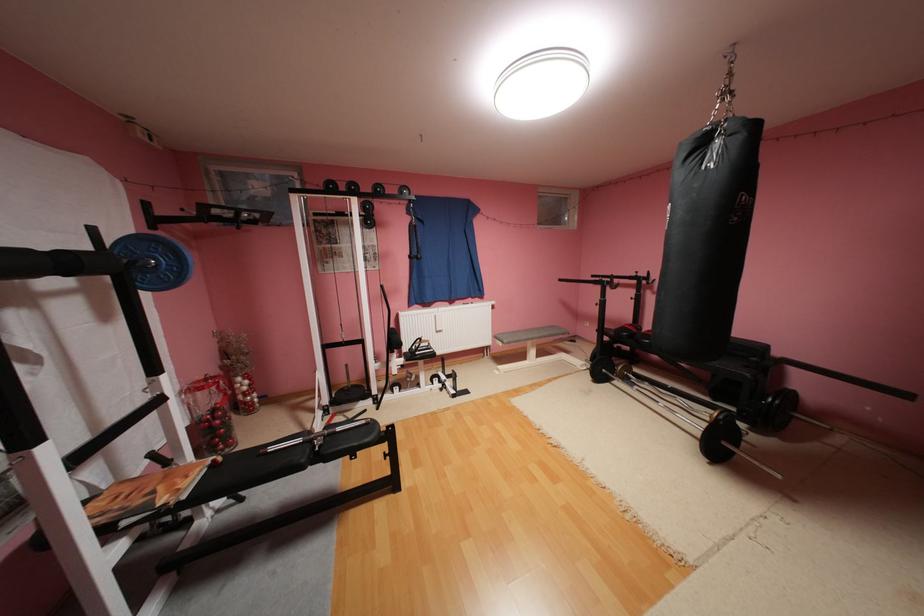
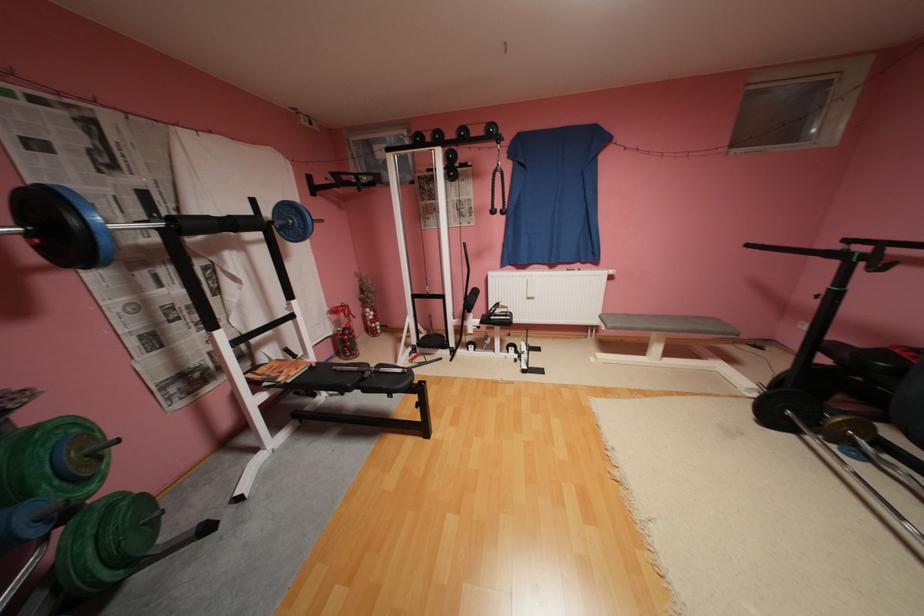
Question: The camera is either moving clockwise (left) or counter-clockwise (right) around the object. The first image is from the beginning of the video and the second image is from the end. Is the camera moving left or right when shooting the video?

Choices:
 (A) Left
 (B) Right

Answer: (B)